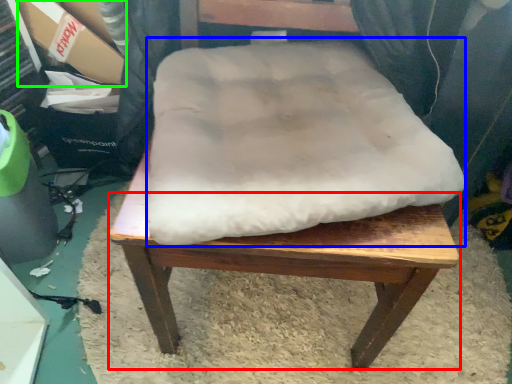
Question: Estimate the real-world distances between objects in this image. Which object is closer to step stool (highlighted by a red box), dog bed (highlighted by a blue box) or cardboard box (highlighted by a green box)?

Choices:
 (A) dog bed
 (B) cardboard box

Answer: (A)